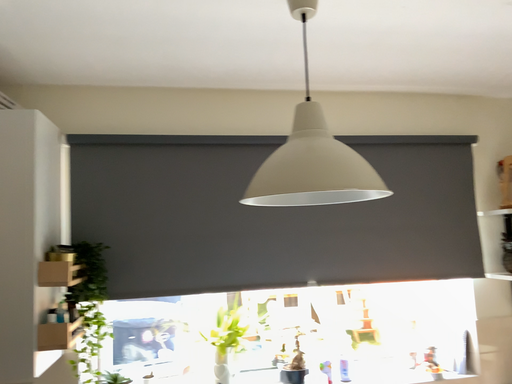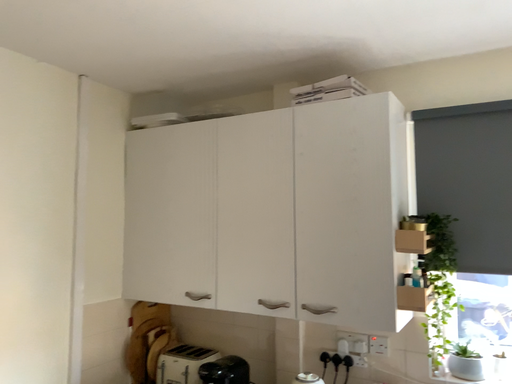
Question: Which way did the camera rotate in the video?

Choices:
 (A) rotated right
 (B) rotated left

Answer: (B)